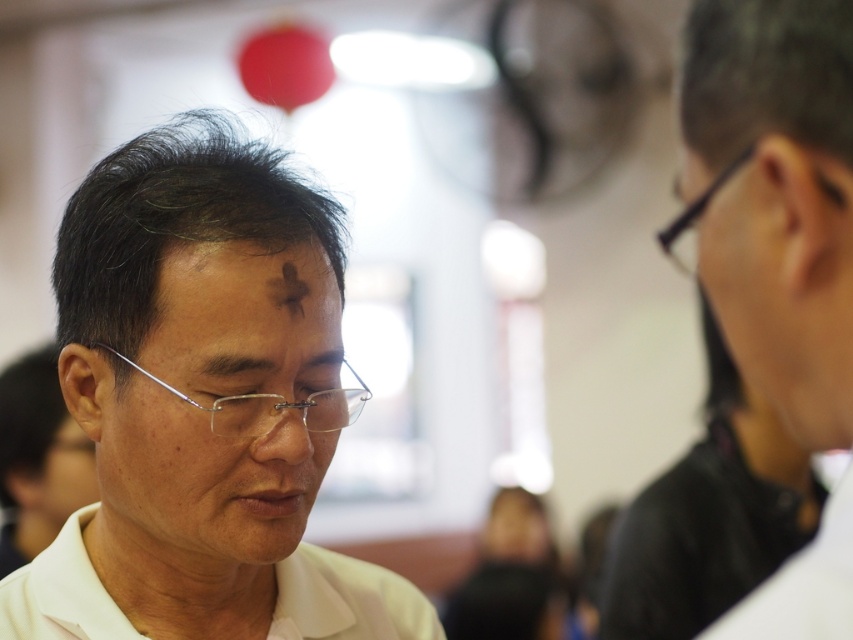
You are a GUI agent. You are given a task and a screenshot of the screen. Output one action in this format:
    pyautogui.click(x=<x>, y=<y>)
    Task: Click on the white matte dress shirt at lower left
    This screenshot has height=640, width=853.
    Given the screenshot: What is the action you would take?
    pyautogui.click(x=346, y=600)

Who is taller, white matte dress shirt at lower left or black plastic glasses at upper right?

Standing taller between the two is white matte dress shirt at lower left.

This screenshot has height=640, width=853. Describe the element at coordinates (346, 600) in the screenshot. I see `white matte dress shirt at lower left` at that location.

Locate an element on the screen. white matte dress shirt at lower left is located at coordinates (346, 600).

In the scene shown: Who is more distant from viewer, (337,298) or (407,636)?

Point (407,636)

From the picture: Measure the distance between brown matte forehead at center and white matte dress shirt at lower left.

brown matte forehead at center is 8.54 inches away from white matte dress shirt at lower left.

Between point (178, 298) and point (322, 554), which one is positioned behind?

The point (322, 554) is behind.

What are the coordinates of `brown matte forehead at center` in the screenshot? It's located at (242, 310).

Who is shorter, matte black shirt at right or black plastic glasses at upper right?

black plastic glasses at upper right

Can you confirm if matte black shirt at right is positioned below black plastic glasses at upper right?

Yes.

What do you see at coordinates (773, 198) in the screenshot?
I see `matte black shirt at right` at bounding box center [773, 198].

The height and width of the screenshot is (640, 853). Find the location of `matte black shirt at right`. matte black shirt at right is located at coordinates (773, 198).